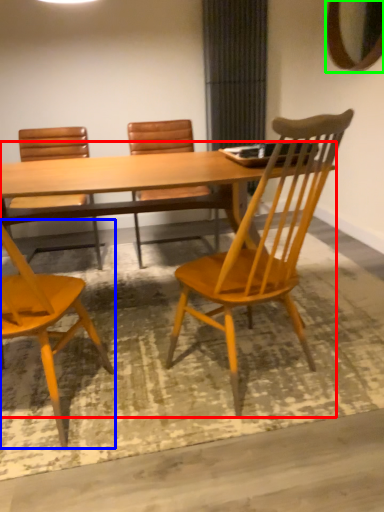
Question: Estimate the real-world distances between objects in this image. Which object is farther from kitchen & dining room table (highlighted by a red box), chair (highlighted by a blue box) or mirror (highlighted by a green box)?

Choices:
 (A) chair
 (B) mirror

Answer: (B)